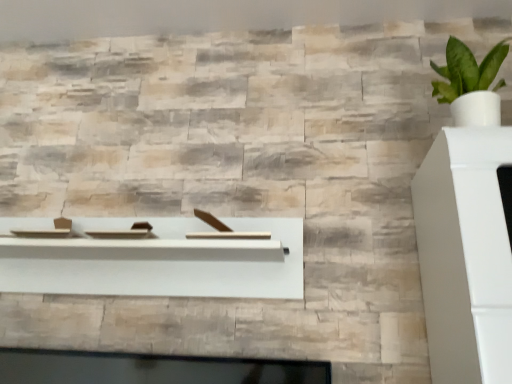
What do you see at coordinates (215, 15) in the screenshot? I see `natural stone wall at upper center` at bounding box center [215, 15].

This screenshot has width=512, height=384. What are the coordinates of `white matte wood shelf at center` in the screenshot? It's located at (162, 262).

This screenshot has width=512, height=384. Describe the element at coordinates (162, 262) in the screenshot. I see `white matte wood shelf at center` at that location.

The height and width of the screenshot is (384, 512). Find the location of `natural stone wall at upper center`. natural stone wall at upper center is located at coordinates (215, 15).

Is point (60, 14) more distant than point (459, 84)?

That is True.

Looking at their sizes, would you say natural stone wall at upper center is wider or thinner than green leafy plant in white pot at upper right?

Clearly, natural stone wall at upper center has more width compared to green leafy plant in white pot at upper right.

Considering their positions, is natural stone wall at upper center located in front of or behind green leafy plant in white pot at upper right?

natural stone wall at upper center is behind green leafy plant in white pot at upper right.

Which is more to the right, green leafy plant in white pot at upper right or natural stone wall at upper center?

green leafy plant in white pot at upper right is more to the right.

Between green leafy plant in white pot at upper right and natural stone wall at upper center, which one has more height?

green leafy plant in white pot at upper right is taller.

Considering the sizes of green leafy plant in white pot at upper right and natural stone wall at upper center in the image, is green leafy plant in white pot at upper right wider or thinner than natural stone wall at upper center?

green leafy plant in white pot at upper right is thinner than natural stone wall at upper center.

Can you confirm if white matte wood shelf at center is positioned to the left of green leafy plant in white pot at upper right?

Indeed, white matte wood shelf at center is positioned on the left side of green leafy plant in white pot at upper right.

Who is taller, white matte wood shelf at center or green leafy plant in white pot at upper right?

green leafy plant in white pot at upper right.

What's the angular difference between white matte wood shelf at center and green leafy plant in white pot at upper right's facing directions?

1.22 degrees.

Is white matte wood shelf at center bigger or smaller than green leafy plant in white pot at upper right?

Considering their sizes, white matte wood shelf at center takes up more space than green leafy plant in white pot at upper right.

From the image's perspective, which one is positioned lower, white matte wood shelf at center or natural stone wall at upper center?

white matte wood shelf at center, from the image's perspective.

Which of these two, white matte wood shelf at center or natural stone wall at upper center, is bigger?

white matte wood shelf at center is bigger.

Which point is more distant from viewer, (25,247) or (225,21)?

The point (225,21) is more distant.

Is natural stone wall at upper center completely or partially inside white matte wood shelf at center?

No.

Could you tell me if natural stone wall at upper center is turned towards white matte wood shelf at center?

No, natural stone wall at upper center is not facing towards white matte wood shelf at center.

Is natural stone wall at upper center inside or outside of white matte wood shelf at center?

natural stone wall at upper center is located beyond the bounds of white matte wood shelf at center.

Can you confirm if natural stone wall at upper center is bigger than white matte wood shelf at center?

No, natural stone wall at upper center is not bigger than white matte wood shelf at center.

Considering the relative positions of natural stone wall at upper center and white matte wood shelf at center in the image provided, is natural stone wall at upper center to the left of white matte wood shelf at center from the viewer's perspective?

Incorrect, natural stone wall at upper center is not on the left side of white matte wood shelf at center.

From the image's perspective, does green leafy plant in white pot at upper right appear higher than white matte wood shelf at center?

Indeed, from the image's perspective, green leafy plant in white pot at upper right is shown above white matte wood shelf at center.

What's the angular difference between green leafy plant in white pot at upper right and white matte wood shelf at center's facing directions?

The facing directions of green leafy plant in white pot at upper right and white matte wood shelf at center are 1.22 degrees apart.

From the picture: Could white matte wood shelf at center be considered to be inside green leafy plant in white pot at upper right?

Definitely not — white matte wood shelf at center is not inside green leafy plant in white pot at upper right.

Image resolution: width=512 pixels, height=384 pixels. What are the coordinates of `houseplant located in front of the natural stone wall at upper center` in the screenshot? It's located at (470, 84).

What are the coordinates of `houseplant that is under the natural stone wall at upper center (from a real-world perspective)` in the screenshot? It's located at (470, 84).

Considering their positions, is green leafy plant in white pot at upper right positioned further to natural stone wall at upper center than white matte wood shelf at center?

Based on the image, white matte wood shelf at center appears to be further to natural stone wall at upper center.

Considering their positions, is white matte wood shelf at center positioned closer to green leafy plant in white pot at upper right than natural stone wall at upper center?

natural stone wall at upper center.

In the scene shown: From the image, which object appears to be farther from white matte wood shelf at center, natural stone wall at upper center or green leafy plant in white pot at upper right?

natural stone wall at upper center is positioned further to the anchor white matte wood shelf at center.

When comparing their distances from white matte wood shelf at center, does green leafy plant in white pot at upper right or natural stone wall at upper center seem further?

Based on the image, natural stone wall at upper center appears to be further to white matte wood shelf at center.

Based on the photo, estimate the real-world distances between objects in this image. Which object is further from green leafy plant in white pot at upper right, natural stone wall at upper center or white matte wood shelf at center?

Based on the image, white matte wood shelf at center appears to be further to green leafy plant in white pot at upper right.

Estimate the real-world distances between objects in this image. Which object is further from natural stone wall at upper center, white matte wood shelf at center or green leafy plant in white pot at upper right?

Based on the image, white matte wood shelf at center appears to be further to natural stone wall at upper center.

The image size is (512, 384). What are the coordinates of `backdrop between white matte wood shelf at center and green leafy plant in white pot at upper right from left to right` in the screenshot? It's located at (215, 15).